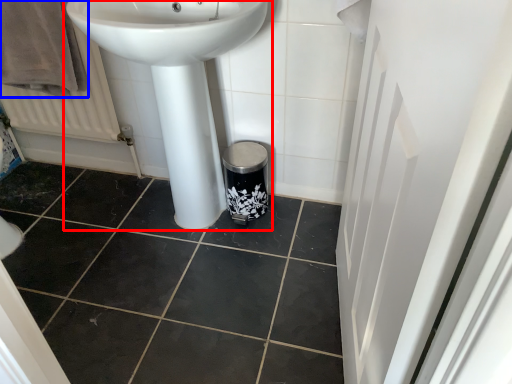
Question: Among these objects, which one is nearest to the camera, sink (highlighted by a red box) or bath towel (highlighted by a blue box)?

Choices:
 (A) sink
 (B) bath towel

Answer: (A)